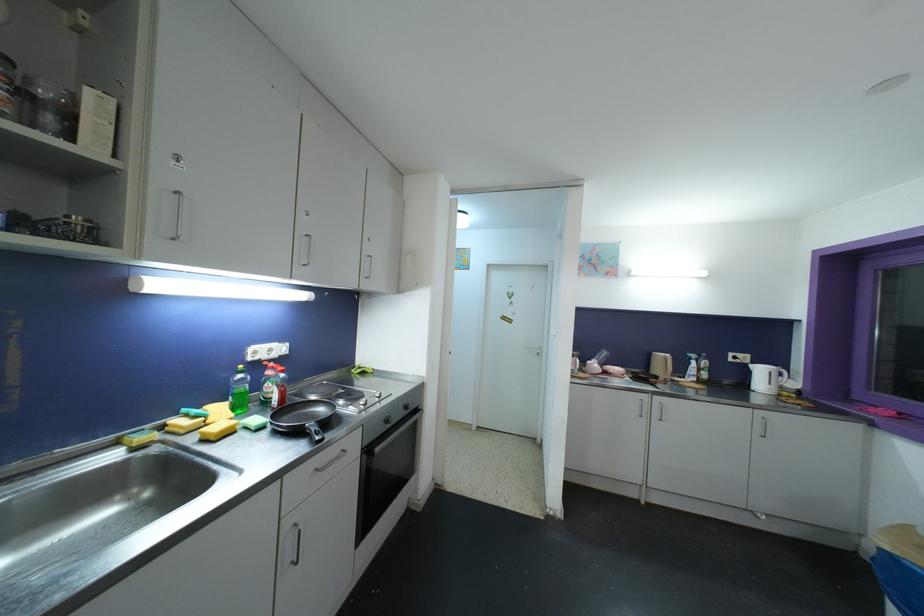
Describe the element at coordinates (238, 391) in the screenshot. Image resolution: width=924 pixels, height=616 pixels. I see `a green bottle` at that location.